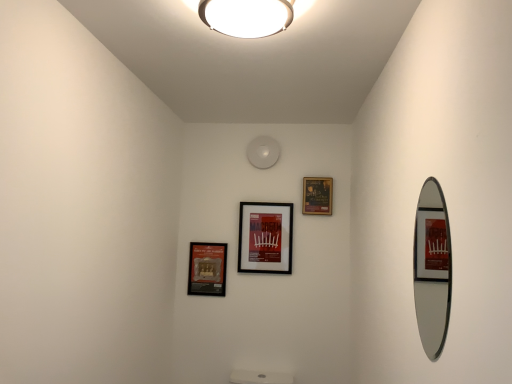
Question: From a real-world perspective, is matte black picture frame at center, the 2th picture frame viewed from the left, above or below white glossy ceiling light at upper center?

Choices:
 (A) above
 (B) below

Answer: (B)

Question: Is matte black picture frame at center, placed as the second picture frame when sorted from right to left, situated inside white glossy ceiling light at upper center or outside?

Choices:
 (A) inside
 (B) outside

Answer: (B)

Question: Which is nearer to the matte black picture frame at upper center, which ranks as the 3th picture frame in left-to-right order?

Choices:
 (A) white glossy ceiling light at upper center
 (B) matte black picture frame at lower left, placed as the 1th picture frame when sorted from left to right
 (C) matte black picture frame at center, the 2th picture frame viewed from the left
 (D) silver-framed mirror at right

Answer: (C)

Question: Estimate the real-world distances between objects in this image. Which object is closer to the matte black picture frame at center, placed as the second picture frame when sorted from right to left?

Choices:
 (A) matte black picture frame at upper center, which ranks as the 3th picture frame in left-to-right order
 (B) silver-framed mirror at right
 (C) white glossy ceiling light at upper center
 (D) matte black picture frame at lower left, placed as the 1th picture frame when sorted from left to right

Answer: (D)